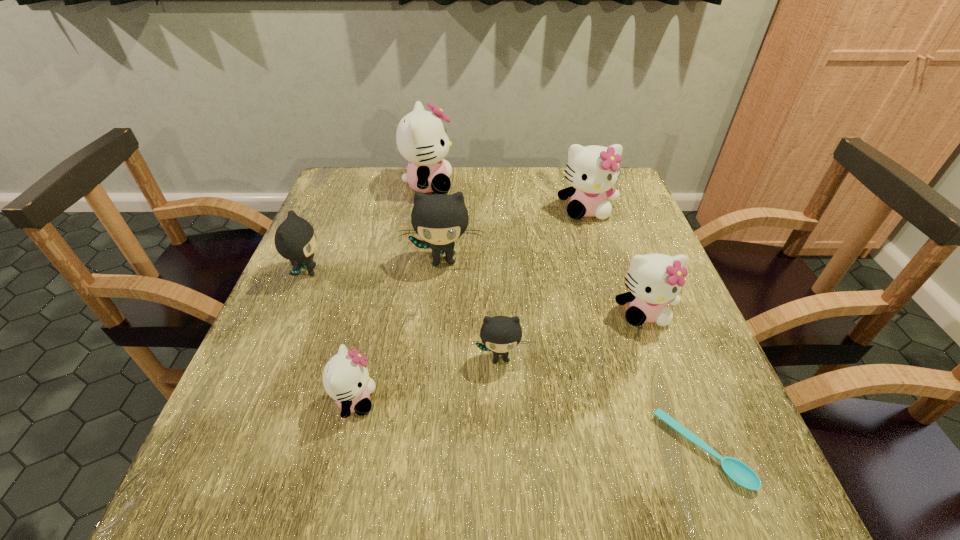
This screenshot has height=540, width=960. I want to click on free space located 0.200m on the front-facing side of the third nearest object, so 505,479.

What are the coordinates of `vacant space located on the back of the spoon` in the screenshot? It's located at (674, 378).

I want to click on object at the near edge, so click(737, 471).

You are a GUI agent. You are given a task and a screenshot of the screen. Output one action in this format:
    pyautogui.click(x=<x>, y=<y>)
    Task: Click on the object present at the left edge
    This screenshot has width=960, height=540.
    Given the screenshot: What is the action you would take?
    pyautogui.click(x=295, y=240)

Find the location of a particular element. This screenshot has height=540, width=960. spoon at the right edge is located at coordinates (737, 471).

The height and width of the screenshot is (540, 960). Identify the location of object that is at the far right corner. [x=592, y=171].

You are a GUI agent. You are given a task and a screenshot of the screen. Output one action in this format:
    pyautogui.click(x=<x>, y=<y>)
    Task: Click on the object at the near right corner
    This screenshot has height=540, width=960.
    Given the screenshot: What is the action you would take?
    pyautogui.click(x=737, y=471)

In the image, there is a desktop. Find the location of `vacant space at the far edge`. vacant space at the far edge is located at coordinates (388, 192).

In the image, there is a desktop. Where is `free region at the near edge`? free region at the near edge is located at coordinates (512, 467).

At what (x,y) coordinates should I click in order to perform the action: click on vacant position at the left edge of the desktop. Please return your answer as a coordinate pair (x, y). Looking at the image, I should click on (355, 253).